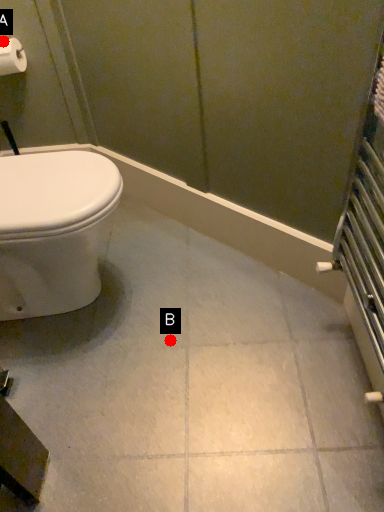
Question: Two points are circled on the image, labeled by A and B beside each circle. Which point is farther to the camera?

Choices:
 (A) A is further
 (B) B is further

Answer: (A)